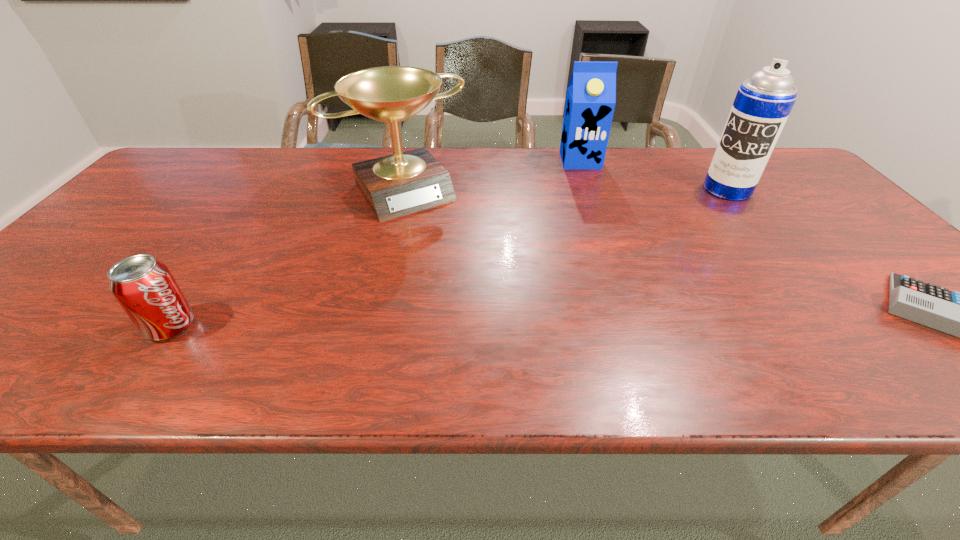
Where is `free space located on the front-facing side of the second object from left to right`? This screenshot has height=540, width=960. free space located on the front-facing side of the second object from left to right is located at coordinates (466, 268).

Find the location of `blank space located 0.150m on the front-facing side of the second object from left to right`. blank space located 0.150m on the front-facing side of the second object from left to right is located at coordinates (451, 249).

Where is `vacant space located on the front-facing side of the second object from left to right`? This screenshot has height=540, width=960. vacant space located on the front-facing side of the second object from left to right is located at coordinates (457, 256).

The height and width of the screenshot is (540, 960). I want to click on free space located 0.060m with the cap open on the third object from left to right, so click(x=587, y=179).

Identify the location of free space located 0.190m with the cap open on the third object from left to right. (593, 202).

Find the location of a particular element. free space located with the cap open on the third object from left to right is located at coordinates (607, 244).

This screenshot has height=540, width=960. I want to click on aerosol can located at the far edge, so click(x=763, y=103).

At what (x,y) coordinates should I click in order to perform the action: click on award that is at the far edge. Please return your answer as a coordinate pair (x, y). Image resolution: width=960 pixels, height=540 pixels. Looking at the image, I should click on (396, 185).

You are a GUI agent. You are given a task and a screenshot of the screen. Output one action in this format:
    pyautogui.click(x=<x>, y=<y>)
    Task: Click on the carton that is at the far edge
    
    Given the screenshot: What is the action you would take?
    pyautogui.click(x=591, y=94)

Locate an element on the screen. The image size is (960, 540). object that is at the near edge is located at coordinates (144, 287).